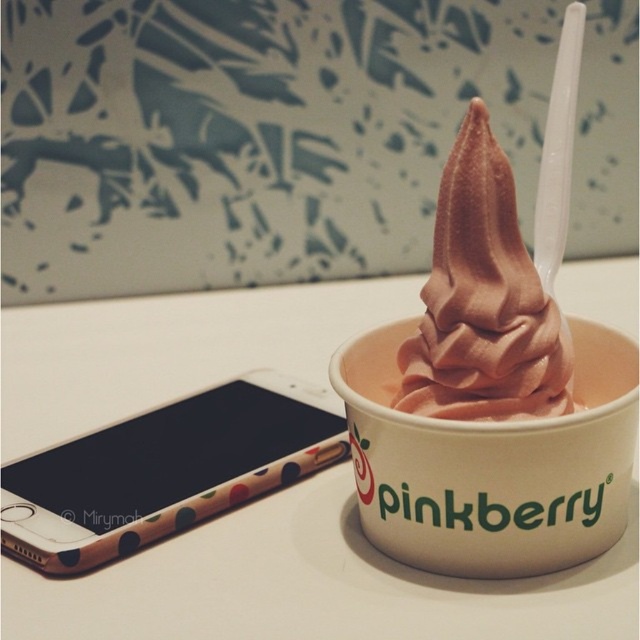
You are holding a camera and want to take a photo of the point at coordinates (x=102, y=458) on the cup. If the camera is focused at 1.11 meters, will the point be in focus?

Yes, the point at coordinates (x=102, y=458) is exactly 1.11 meters away from the camera, so it will be in focus.

You are a customer at Pinkberry and want to place your phone on the surface where the cup is located. Given that the phone requires a space of at least 10 cm by 10 cm, can you determine if the white glossy table at center has enough space for your phone?

The white glossy table at center has a surface area that accommodates the cup and its contents. Since the phone requires only 10 cm by 10 cm of space, it is likely there is sufficient room unless the table is extremely small, but the description does not specify table dimensions. However, given typical table sizes and the placement of the cup, the white glossy table at center should have enough space for the phone.

You are setting up a phone call and need to place your polka dot plastic phone at lower left on the white glossy table at center. Will the phone fit on the table?

The white glossy table at center is bigger than the polka dot plastic phone at lower left, so yes, the phone will fit on the table.